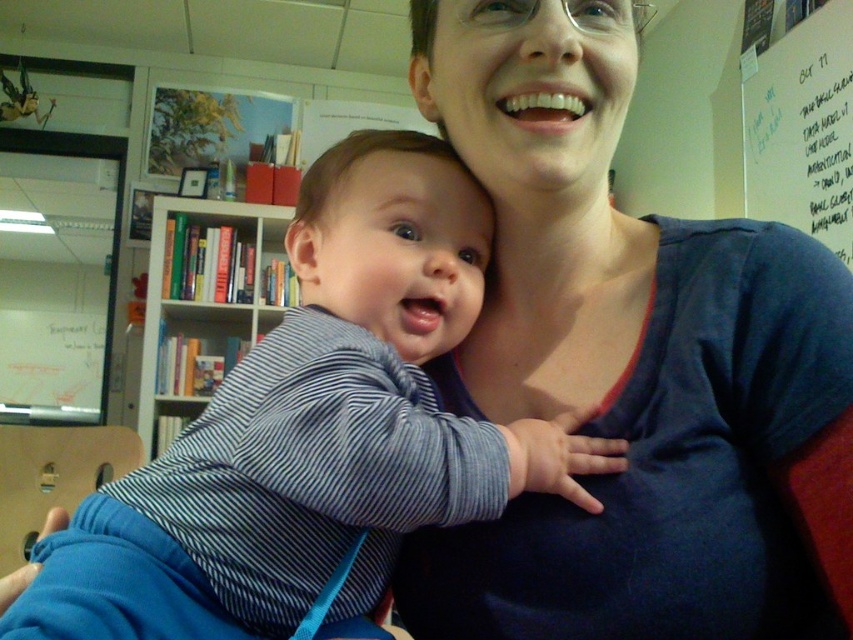
Question: Which point is closer to the camera?

Choices:
 (A) striped cotton shirt at center
 (B) blue cotton shirt at center
 (C) hardcover books at left

Answer: (A)

Question: Which point is closer to the camera?

Choices:
 (A) click(834, 173)
 (B) click(415, 259)

Answer: (B)

Question: Is striped cotton shirt at center to the left of hardcover books at left from the viewer's perspective?

Choices:
 (A) no
 (B) yes

Answer: (A)

Question: Estimate the real-world distances between objects in this image. Which object is closer to the blue cotton shirt at center?

Choices:
 (A) striped cotton shirt at center
 (B) white dry erase board at upper right
 (C) hardcover books at left

Answer: (A)

Question: Is blue cotton shirt at center thinner than hardcover books at left?

Choices:
 (A) yes
 (B) no

Answer: (A)

Question: Is blue cotton shirt at center to the right of hardcover books at left from the viewer's perspective?

Choices:
 (A) no
 (B) yes

Answer: (B)